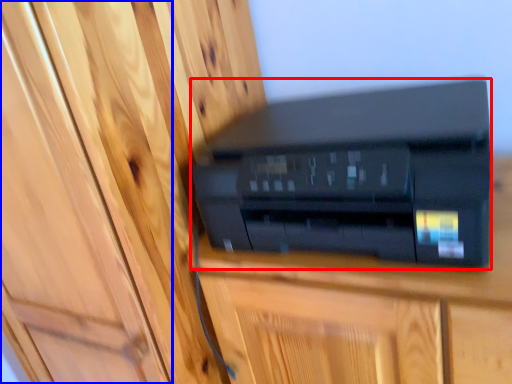
Question: Among these objects, which one is farthest to the camera, printer (highlighted by a red box) or door (highlighted by a blue box)?

Choices:
 (A) printer
 (B) door

Answer: (A)